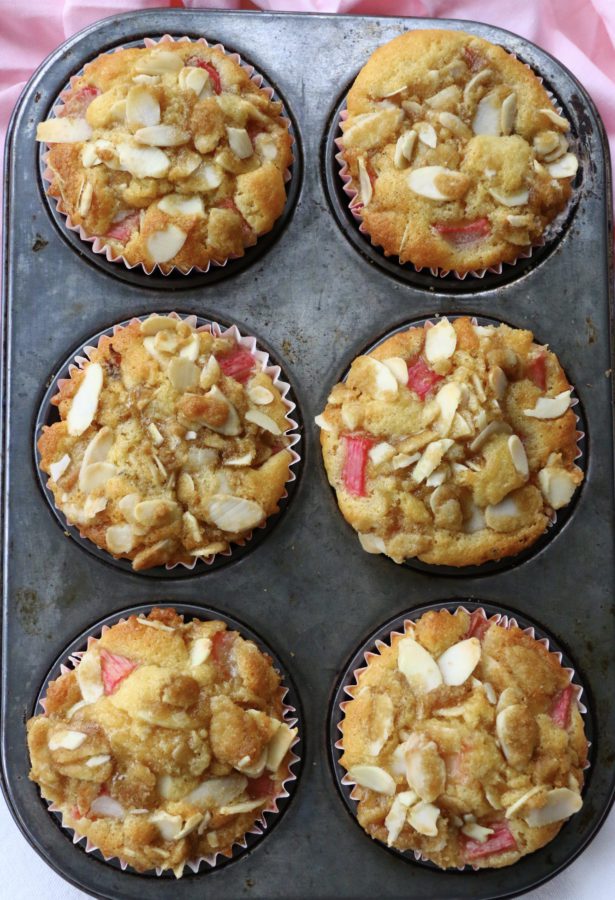
Where is `baking pan`? The height and width of the screenshot is (900, 615). baking pan is located at coordinates (310, 864).